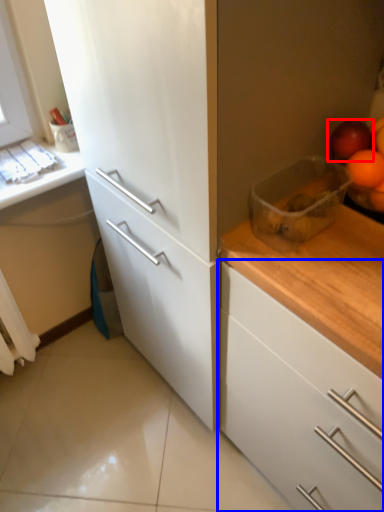
Question: Which object is closer to the camera taking this photo, apple (highlighted by a red box) or cabinetry (highlighted by a blue box)?

Choices:
 (A) apple
 (B) cabinetry

Answer: (B)